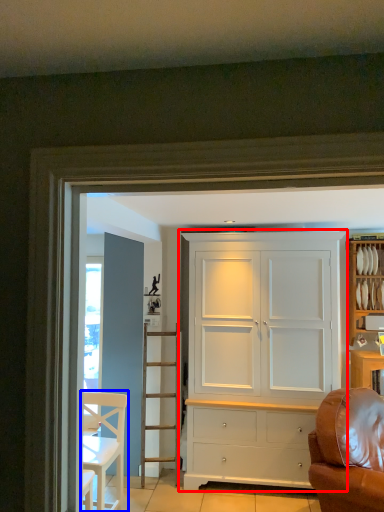
Question: Which object is closer to the camera taking this photo, cupboard (highlighted by a red box) or chair (highlighted by a blue box)?

Choices:
 (A) cupboard
 (B) chair

Answer: (B)